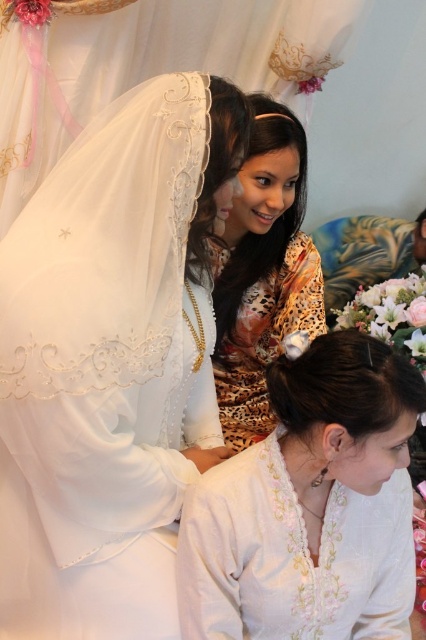
Question: Is white floral blouse at lower center smaller than leopard print dress at center?

Choices:
 (A) no
 (B) yes

Answer: (B)

Question: Which object is positioned closest to the white lace veil at upper left?

Choices:
 (A) white floral blouse at lower center
 (B) leopard print dress at center

Answer: (A)

Question: Which of the following is the closest to the observer?

Choices:
 (A) (264, 344)
 (B) (189, 579)
 (C) (20, 340)

Answer: (C)

Question: Which of the following is the closest to the observer?

Choices:
 (A) (26, 408)
 (B) (287, 320)
 (C) (388, 548)

Answer: (A)

Question: Is white lace veil at upper left further to camera compared to white floral blouse at lower center?

Choices:
 (A) no
 (B) yes

Answer: (B)

Question: Is white floral blouse at lower center positioned at the back of leopard print dress at center?

Choices:
 (A) no
 (B) yes

Answer: (A)